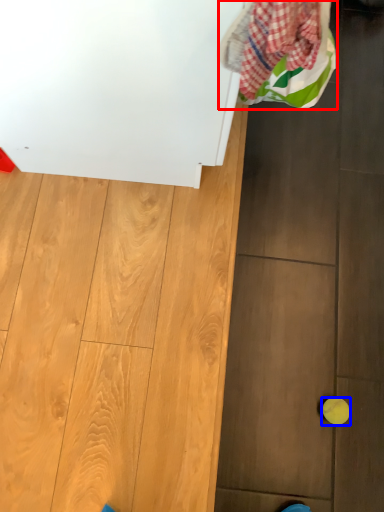
Question: Which point is closer to the camera, laundry (highlighted by a red box) or ball (highlighted by a blue box)?

Choices:
 (A) laundry
 (B) ball

Answer: (A)